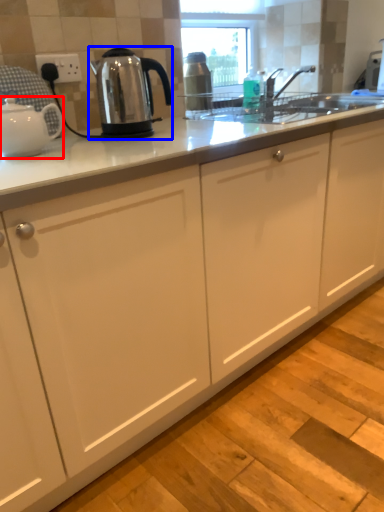
Question: Which object appears closest to the camera in this image, kettle (highlighted by a red box) or kettle (highlighted by a blue box)?

Choices:
 (A) kettle
 (B) kettle

Answer: (A)